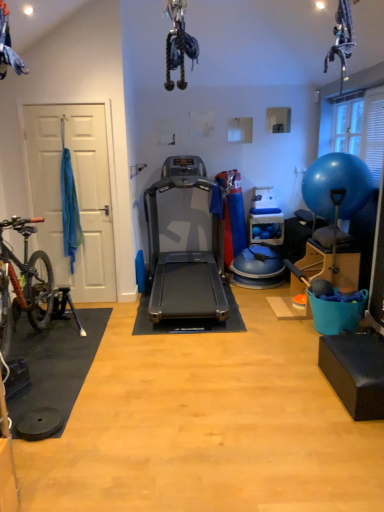
Question: In the image, is silver metallic treadmill at center positioned in front of or behind transparent plastic window screen at upper right?

Choices:
 (A) behind
 (B) front

Answer: (B)

Question: From the image's perspective, is silver metallic treadmill at center located above or below transparent plastic window screen at upper right?

Choices:
 (A) below
 (B) above

Answer: (A)

Question: Based on their relative distances, which object is nearer to the blue rubber ball at right?

Choices:
 (A) transparent plastic window screen at upper right
 (B) silver metallic treadmill at center

Answer: (A)

Question: Estimate the real-world distances between objects in this image. Which object is farther from the blue rubber ball at right?

Choices:
 (A) transparent plastic window screen at upper right
 (B) silver metallic treadmill at center

Answer: (B)